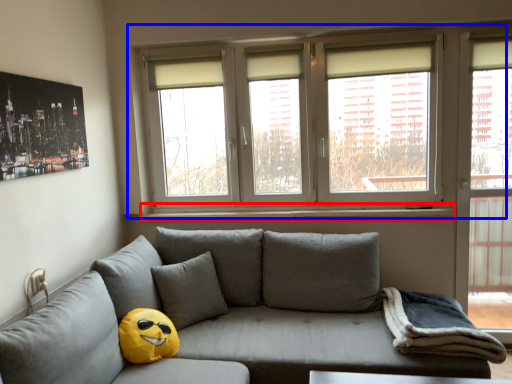
Question: Which of the following is the farthest to the observer, window sill (highlighted by a red box) or window (highlighted by a blue box)?

Choices:
 (A) window sill
 (B) window

Answer: (A)